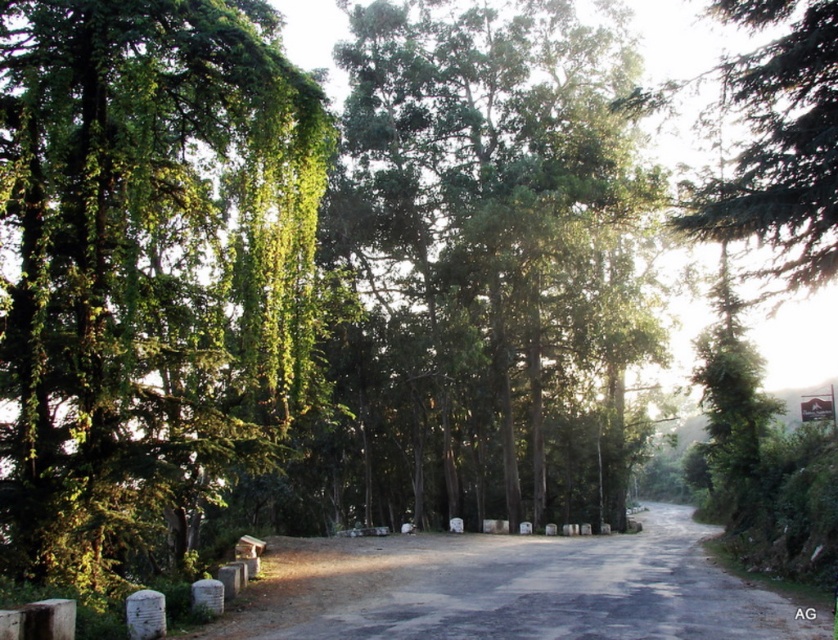
You are a hiker walking along the road and want to take a photo of the green leafy tree at left and the green leafy trees at center. Which tree should you stand closer to in order to capture both in a single frame?

You should stand closer to the green leafy trees at center because the green leafy tree at left is positioned under them, meaning it is closer to the camera. By positioning yourself nearer to the central trees, you can include both the foreground tree at left and the background trees at center in your photo.

You are standing at the point marked by the coordinates (145, 268) in the image. Describe what you see immediately around you, including any nearby trees or plants.

The point at coordinates (145, 268) is marked by a green leafy tree at left, so you would see the trunk and branches of this tree close by.